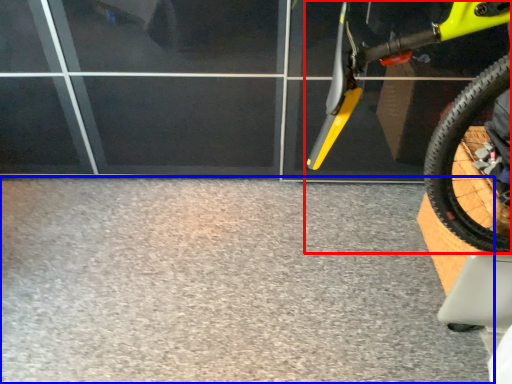
Question: Which point is closer to the camera, bicycle (highlighted by a red box) or concrete (highlighted by a blue box)?

Choices:
 (A) bicycle
 (B) concrete

Answer: (A)